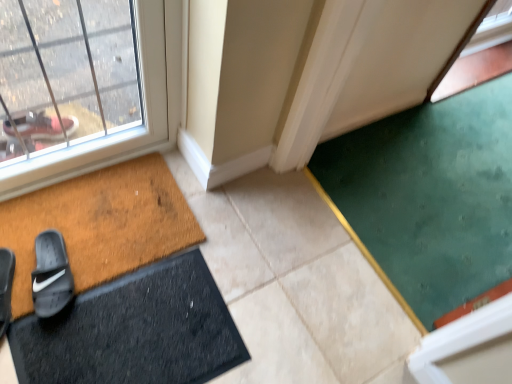
At what (x,y) coordinates should I click in order to perform the action: click on free space above brown textured doormat at lower left, which appears as the 1th bath mat when viewed from the top (from a real-world perspective). Please return your answer as a coordinate pair (x, y). The height and width of the screenshot is (384, 512). Looking at the image, I should click on 74,220.